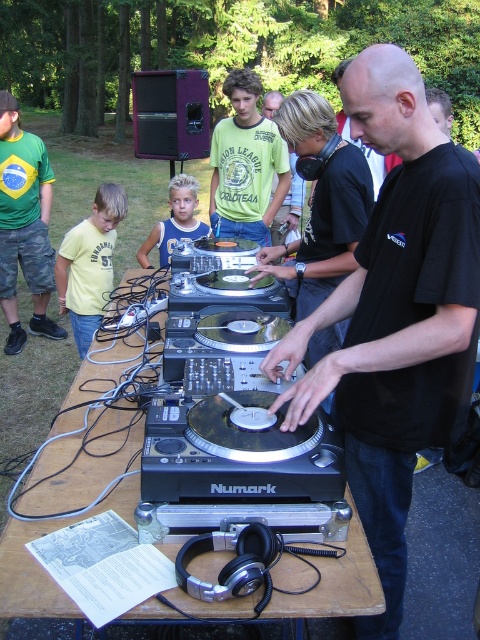
Question: In this image, where is wooden table at center located relative to blue jersey at center?

Choices:
 (A) left
 (B) right

Answer: (B)

Question: Which of the following is the farthest from the observer?

Choices:
 (A) black matte shirt at center
 (B) wooden table at center
 (C) yellow matte shirt at left

Answer: (C)

Question: Can you confirm if green matte shirt at center is positioned above yellow matte shirt at left?

Choices:
 (A) yes
 (B) no

Answer: (A)

Question: Does black matte shirt at center appear over yellow matte shirt at left?

Choices:
 (A) no
 (B) yes

Answer: (A)

Question: Which of the following is the farthest from the observer?

Choices:
 (A) black matte shirt at center
 (B) yellow matte shirt at left
 (C) wooden table at center

Answer: (B)

Question: Which point is farther to the camera?

Choices:
 (A) black matte shirt at center
 (B) green jersey at left

Answer: (B)